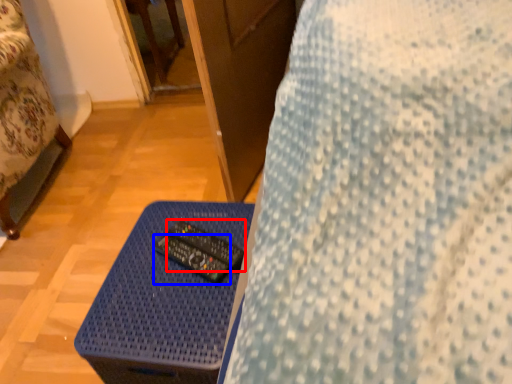
Question: Which object is closer to the camera taking this photo, control (highlighted by a red box) or control (highlighted by a blue box)?

Choices:
 (A) control
 (B) control

Answer: (B)